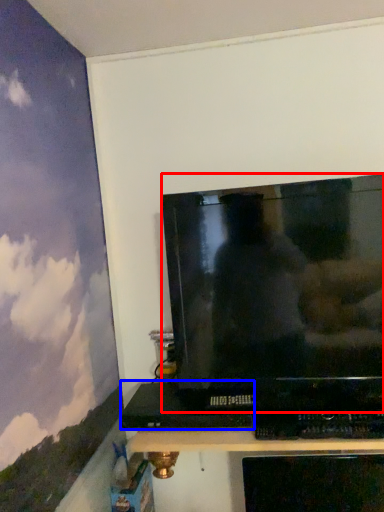
Question: Among these objects, which one is farthest to the camera, television (highlighted by a red box) or computer (highlighted by a blue box)?

Choices:
 (A) television
 (B) computer

Answer: (B)